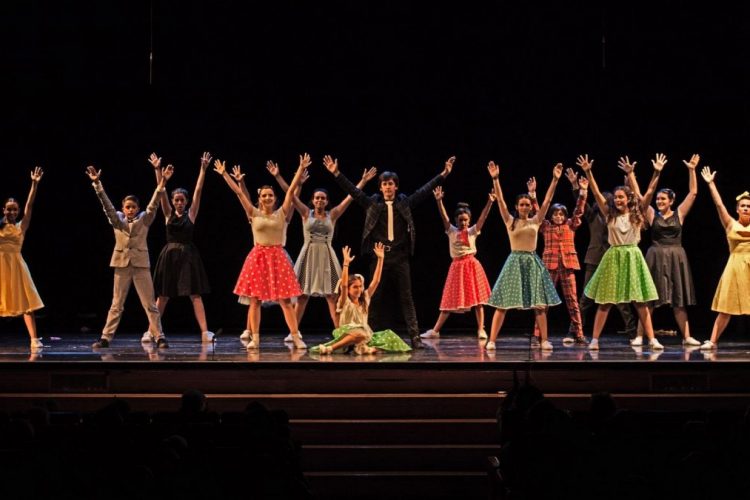
Where is `stair`? stair is located at coordinates (364, 480), (361, 445), (344, 421), (338, 392).